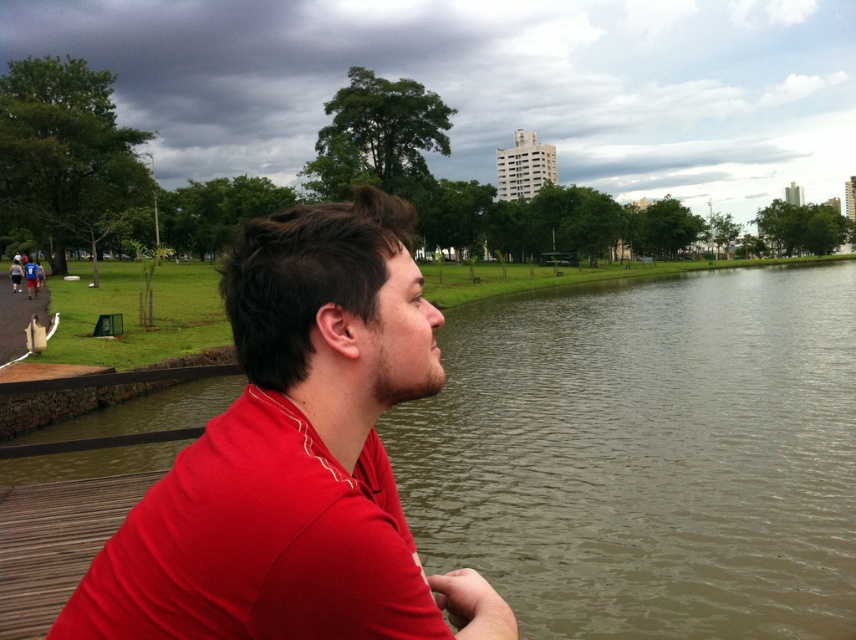
Question: Which point is farther from the camera taking this photo?

Choices:
 (A) (233, 628)
 (B) (349, 636)
 (C) (394, 472)

Answer: (C)

Question: Can you confirm if brown murky water at center is wider than matte red polo shirt at center?

Choices:
 (A) yes
 (B) no

Answer: (A)

Question: Which object is positioned closest to the brown murky water at center?

Choices:
 (A) matte red shirt at center
 (B) matte red polo shirt at center

Answer: (B)

Question: From the image, what is the correct spatial relationship of matte red shirt at center in relation to matte red polo shirt at center?

Choices:
 (A) left
 (B) right

Answer: (B)

Question: Among these objects, which one is nearest to the camera?

Choices:
 (A) matte red shirt at center
 (B) brown murky water at center
 (C) matte red polo shirt at center

Answer: (C)

Question: Where is brown murky water at center located in relation to matte red shirt at center in the image?

Choices:
 (A) left
 (B) right

Answer: (B)